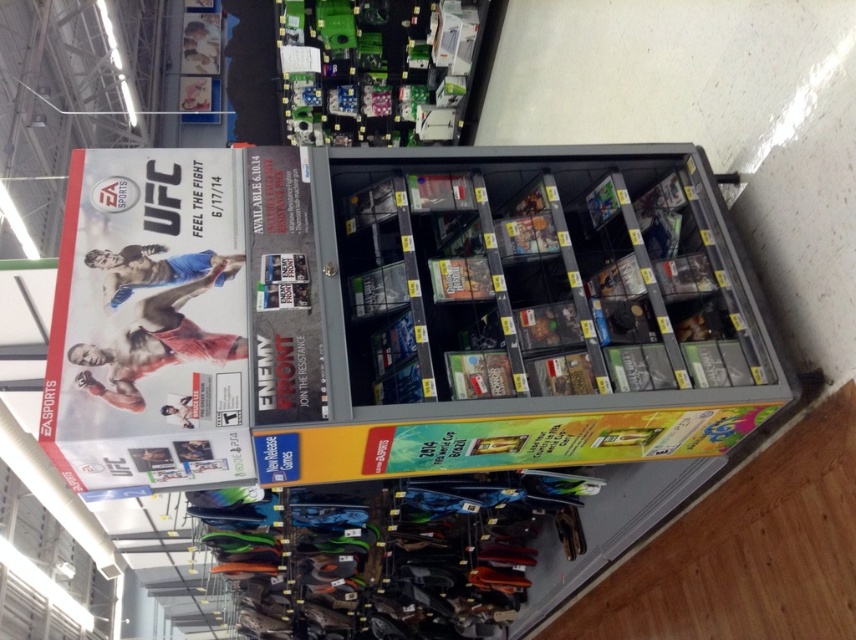
You are a customer looking at the metallic gray shelf at center and the matte plastic UFC poster at upper left. Which object is closer to you?

The metallic gray shelf at center is closer to you because the matte plastic UFC poster at upper left is behind it.

You are a customer holding a 2.5 meter long ladder. You need to reach the green plastic electronics at upper center from the metallic gray shelf at center. Can you reach it with your ladder?

The metallic gray shelf at center is 2.46 meters away from the green plastic electronics at upper center. Since the ladder is 2.5 meters long, it is slightly longer than the distance between them, so you can reach the green plastic electronics at upper center with the ladder.

You are a customer looking for a UFC poster and a shelf to place your items. You see the metallic gray shelf at center and the matte plastic ufc poster at upper left. Which object is located to the right of the other?

The metallic gray shelf at center is located to the right of the matte plastic ufc poster at upper left.